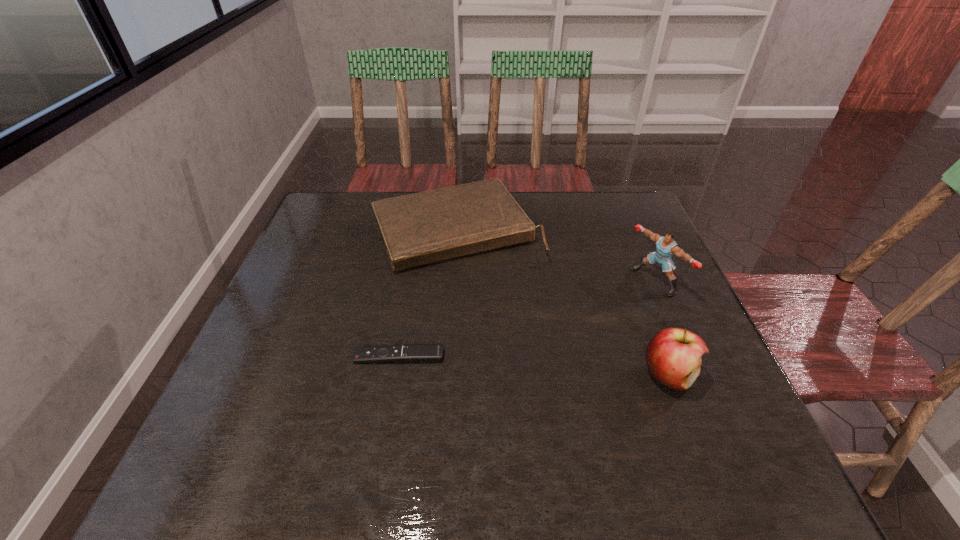
Find the location of a particular element. the shortest object is located at coordinates (419, 352).

The width and height of the screenshot is (960, 540). In order to click on apple in this screenshot , I will do `click(673, 356)`.

Where is `the tallest object`? This screenshot has height=540, width=960. the tallest object is located at coordinates (666, 246).

Image resolution: width=960 pixels, height=540 pixels. Identify the location of the second shortest object. (425, 227).

Locate an element on the screen. The height and width of the screenshot is (540, 960). free space located 0.310m on the right of the shortest object is located at coordinates (588, 356).

Locate an element on the screen. The width and height of the screenshot is (960, 540). vacant region located 0.050m on the front-facing side of the puncher is located at coordinates (627, 300).

Identify the location of vacant space located 0.160m on the front-facing side of the puncher. The width and height of the screenshot is (960, 540). coord(593,319).

In order to click on vacant position located 0.100m on the front-facing side of the puncher in this screenshot , I will do `click(612, 308)`.

This screenshot has width=960, height=540. Identify the location of free space located 0.150m on the spine side of the second shortest object. pyautogui.click(x=510, y=311).

The width and height of the screenshot is (960, 540). What are the coordinates of `vacant point located 0.240m on the spine side of the second shortest object` in the screenshot? It's located at (526, 338).